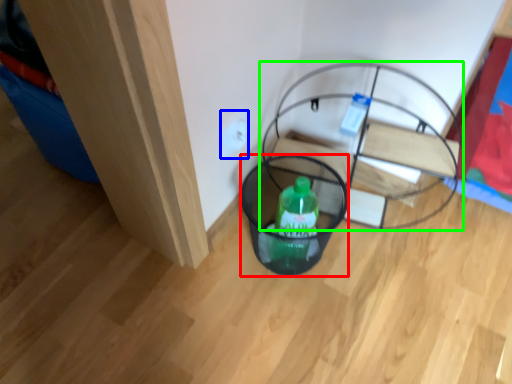
Question: Which is farther away from basket (highlighted by a red box)? electric outlet (highlighted by a blue box) or furniture (highlighted by a green box)?

Choices:
 (A) electric outlet
 (B) furniture

Answer: (A)